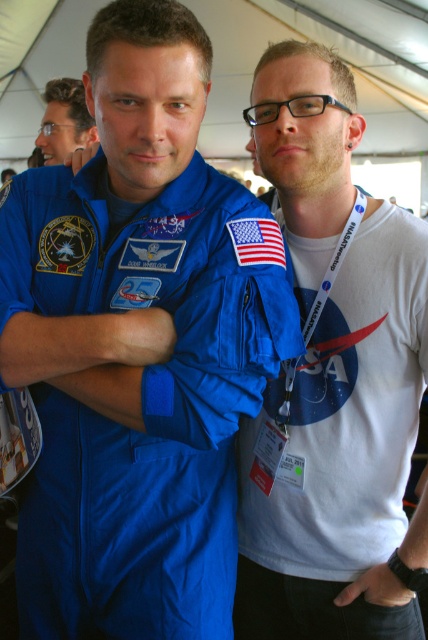
Is point (95, 321) behind point (401, 467)?

No, (95, 321) is in front of (401, 467).

Who is higher up, matte blue jumpsuit at left or blue fabric astronaut suit at center?

Positioned higher is matte blue jumpsuit at left.

This screenshot has height=640, width=428. Describe the element at coordinates (146, 365) in the screenshot. I see `matte blue jumpsuit at left` at that location.

Where is `matte blue jumpsuit at left`? This screenshot has height=640, width=428. matte blue jumpsuit at left is located at coordinates (146, 365).

Is matte blue jumpsuit at left wider than matte black hair at upper left?

Yes.

Can you confirm if matte blue jumpsuit at left is bigger than matte black hair at upper left?

Indeed, matte blue jumpsuit at left has a larger size compared to matte black hair at upper left.

Who is more distant from viewer, (205, 40) or (59, 122)?

The point (59, 122) is behind.

The height and width of the screenshot is (640, 428). I want to click on matte blue jumpsuit at left, so click(146, 365).

Does blue fabric astronaut suit at center have a lesser width compared to matte black hair at upper left?

No, blue fabric astronaut suit at center is not thinner than matte black hair at upper left.

Who is positioned more to the left, blue fabric astronaut suit at center or matte black hair at upper left?

Positioned to the left is matte black hair at upper left.

Find the location of a particular element. blue fabric astronaut suit at center is located at coordinates (333, 381).